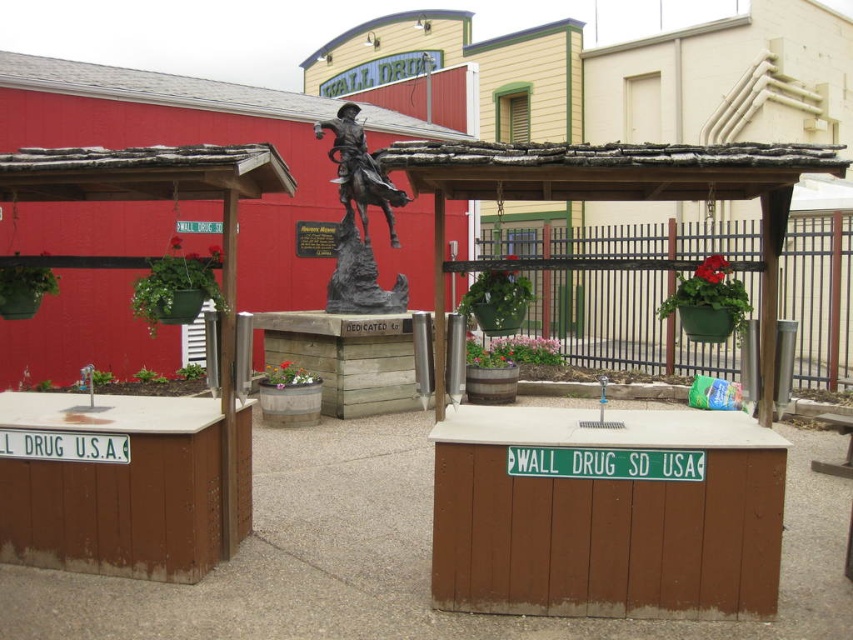
Does green metal fence at center come in front of bronze statue at center?

No, green metal fence at center is further to the viewer.

Which is more to the right, green metal fence at center or bronze statue at center?

green metal fence at center is more to the right.

Describe the element at coordinates (619, 321) in the screenshot. Image resolution: width=853 pixels, height=640 pixels. I see `green metal fence at center` at that location.

Locate an element on the screen. This screenshot has width=853, height=640. green metal fence at center is located at coordinates (619, 321).